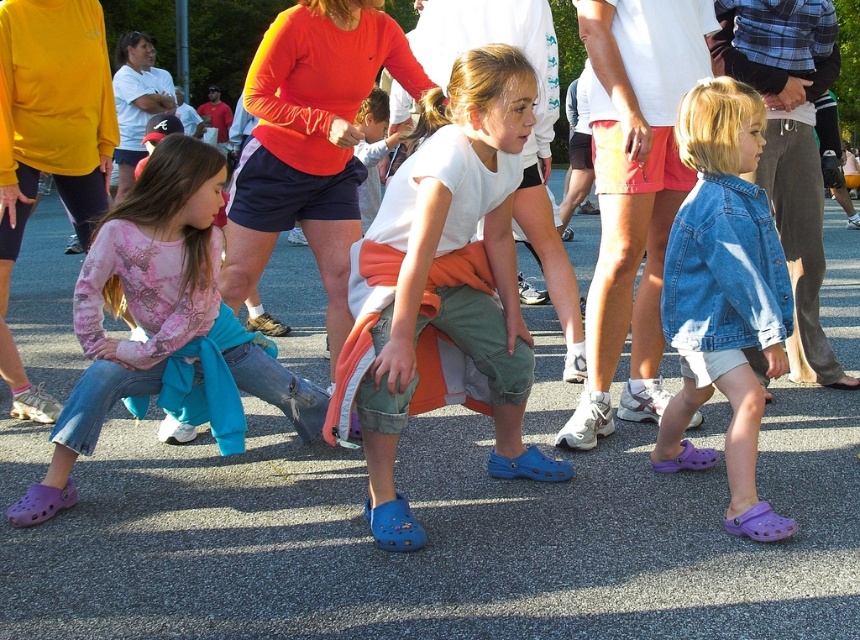
You are a photographer trying to capture a photo of the two children in the scene. The children are the white matte shirt at center and the purple croc shoes at lower left. Since you want to ensure both are in focus, you need to know their height difference. Which child is taller?

The white matte shirt at center is much taller than the purple croc shoes at lower left, so the child wearing the white matte shirt at center is taller.

You are a photographer standing at the center of the scene. You want to place your camera at a position that can capture both the purple croc shoes at lower left and the middle child in the frame. Based on their positions, where should you position your camera horizontally? Is it to the left, right, or centered between them?

The purple croc shoes at lower left are located at point 0.473 on the horizontal axis. Since the middle child is positioned centrally in the scene, the camera should be centered between them to ensure both are in frame.

You are a photographer trying to capture a group photo of the white matte shirt at center and the purple croc shoes at lower left. Since you want both subjects to be in the frame, which direction should you move your camera to include both?

The white matte shirt at center is to the right of purple croc shoes at lower left, so you should move your camera to the left to include both subjects in the frame.